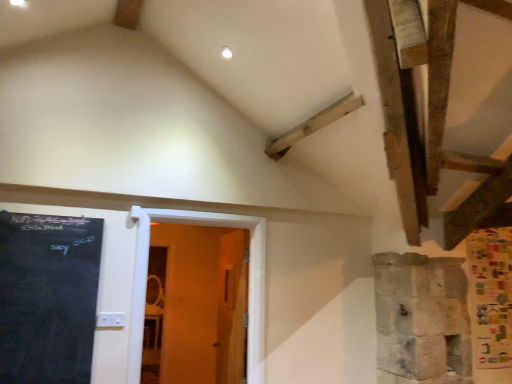
The image size is (512, 384). Identify the location of black chalkboard at left. (48, 297).

This screenshot has width=512, height=384. What do you see at coordinates (48, 297) in the screenshot?
I see `black chalkboard at left` at bounding box center [48, 297].

The image size is (512, 384). What do you see at coordinates (248, 288) in the screenshot?
I see `wooden door at center` at bounding box center [248, 288].

Identify the location of wooden door at center. This screenshot has height=384, width=512. coord(248,288).

In order to click on black chalkboard at left in this screenshot , I will do 48,297.

Between black chalkboard at left and wooden door at center, which one appears on the left side from the viewer's perspective?

black chalkboard at left.

Is black chalkboard at left further to camera compared to wooden door at center?

No, black chalkboard at left is closer to the viewer.

Is point (67, 236) positioned before point (173, 210)?

That is True.

From the image's perspective, would you say black chalkboard at left is positioned over wooden door at center?

Yes.

From a real-world perspective, between black chalkboard at left and wooden door at center, who is vertically higher?

In real-world perspective, black chalkboard at left is above.

Which object is wider, black chalkboard at left or wooden door at center?

wooden door at center is wider.

Does black chalkboard at left have a lesser height compared to wooden door at center?

Yes, black chalkboard at left is shorter than wooden door at center.

Does black chalkboard at left have a smaller size compared to wooden door at center?

Yes.

Is black chalkboard at left positioned beyond the bounds of wooden door at center?

black chalkboard at left lies outside wooden door at center's area.

Are black chalkboard at left and wooden door at center beside each other?

black chalkboard at left and wooden door at center are not in contact.

Could you tell me if black chalkboard at left is turned towards wooden door at center?

No.

Can you tell me how much black chalkboard at left and wooden door at center differ in facing direction?

0.00652 degrees.

How distant is black chalkboard at left from wooden door at center?

black chalkboard at left is 22.13 inches from wooden door at center.

Locate an element on the screen. The image size is (512, 384). door below the black chalkboard at left (from the image's perspective) is located at coordinates (248, 288).

Considering the relative positions of wooden door at center and black chalkboard at left in the image provided, is wooden door at center to the left of black chalkboard at left from the viewer's perspective?

No, wooden door at center is not to the left of black chalkboard at left.

Considering their positions, is wooden door at center located in front of or behind black chalkboard at left?

wooden door at center is behind black chalkboard at left.

Is point (256, 365) positioned after point (34, 266)?

That is True.

From the image's perspective, does wooden door at center appear higher than black chalkboard at left?

Incorrect, from the image's perspective, wooden door at center is lower than black chalkboard at left.

From a real-world perspective, does wooden door at center sit lower than black chalkboard at left?

Correct, in the physical world, wooden door at center is lower than black chalkboard at left.

Looking at this image, looking at their sizes, would you say wooden door at center is wider or thinner than black chalkboard at left?

wooden door at center is wider than black chalkboard at left.

Who is shorter, wooden door at center or black chalkboard at left?

Standing shorter between the two is black chalkboard at left.

Consider the image. Which of these two, wooden door at center or black chalkboard at left, is smaller?

black chalkboard at left is smaller.

Would you say wooden door at center is outside black chalkboard at left?

Yes, wooden door at center is located beyond the bounds of black chalkboard at left.

Is wooden door at center next to black chalkboard at left and touching it?

No, wooden door at center is not with black chalkboard at left.

Is wooden door at center facing towards black chalkboard at left?

No.

How far apart are wooden door at center and black chalkboard at left?

wooden door at center and black chalkboard at left are 22.13 inches apart from each other.

This screenshot has width=512, height=384. I want to click on bulletin board above the wooden door at center (from a real-world perspective), so click(48, 297).

Find the location of a particular element. door below the black chalkboard at left (from a real-world perspective) is located at coordinates (248, 288).

The height and width of the screenshot is (384, 512). I want to click on bulletin board that appears above the wooden door at center (from the image's perspective), so click(48, 297).